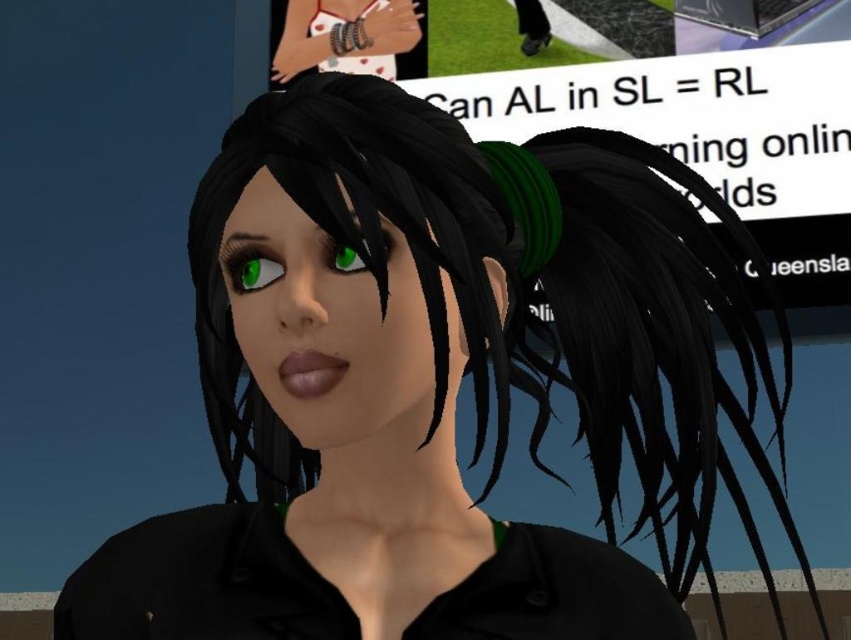
You are a photographer adjusting your camera settings to focus on two points in the image. The first point is labeled as point (252, 269) and the second is point (340, 260). Which point should you focus on first if you want to capture the closest object to the camera?

Point (252, 269) is further to the viewer than point (340, 260), so you should focus on point (252, 269) first as it is closer to the camera.

In the scene shown: You are designing a new accessory collection and want to ensure that the green rubber hairband at right and the green matte eye at center are proportionally balanced. Based on their sizes, which object should be scaled down to achieve this balance?

The green rubber hairband at right should be scaled down because its width is larger than the green matte eye at center, so reducing its size would create a more balanced proportion between the two objects.

You are a photographer adjusting your camera settings to capture the character. The green rubber hairband at right is represented by point [606,141]. Where should you focus your camera to ensure the green rubber hairband at right is in sharp focus?

You should focus your camera on the point [606,141] where the green rubber hairband at right is located to ensure it is in sharp focus.